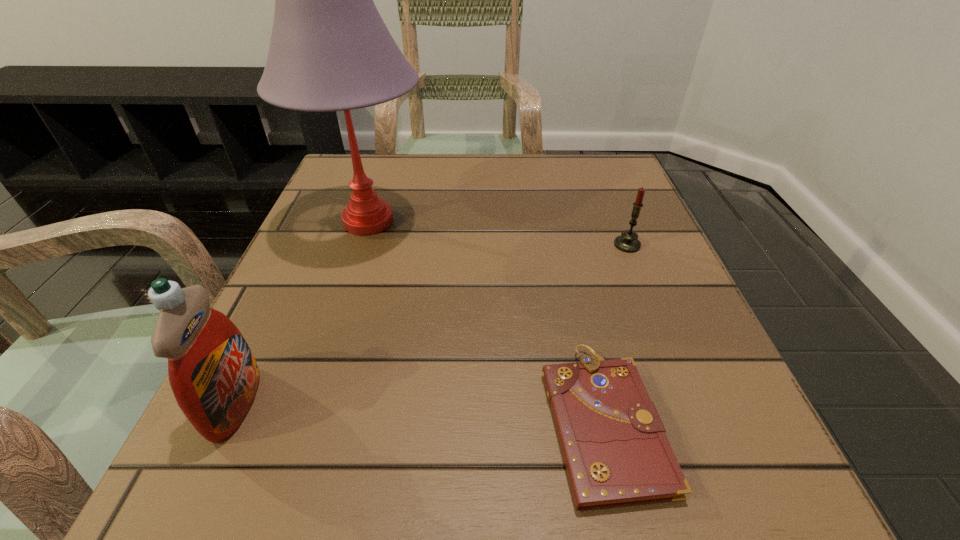
Find the location of a particular element. The width and height of the screenshot is (960, 540). table lamp is located at coordinates point(330,50).

At what (x,y) coordinates should I click in order to perform the action: click on the second tallest object. Please return your answer as a coordinate pair (x, y). This screenshot has height=540, width=960. Looking at the image, I should click on (213, 374).

This screenshot has width=960, height=540. Find the location of `the third tallest object`. the third tallest object is located at coordinates (628, 242).

This screenshot has height=540, width=960. I want to click on candle, so click(x=628, y=242).

Locate an element on the screen. The image size is (960, 540). the second object from right to left is located at coordinates (616, 453).

Image resolution: width=960 pixels, height=540 pixels. Find the location of `notebook`. notebook is located at coordinates (616, 453).

Find the location of a particular element. The height and width of the screenshot is (540, 960). free space located 0.370m on the front-facing side of the tallest object is located at coordinates (612, 221).

The width and height of the screenshot is (960, 540). What are the coordinates of `blank area located 0.120m on the front surface of the second tallest object` in the screenshot? It's located at (346, 403).

Where is `free region located on the left of the second shortest object`? free region located on the left of the second shortest object is located at coordinates 520,245.

Image resolution: width=960 pixels, height=540 pixels. Find the location of `free space located 0.250m on the left of the third object from left to right`. free space located 0.250m on the left of the third object from left to right is located at coordinates (354, 420).